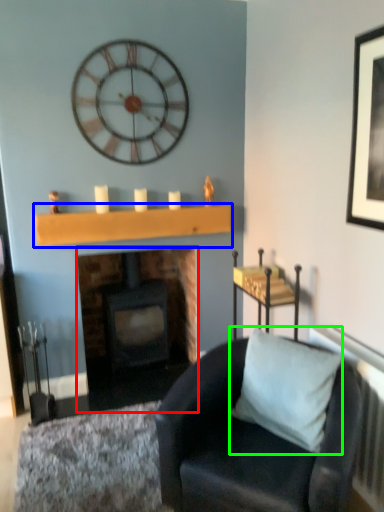
Question: Estimate the real-world distances between objects in this image. Which object is closer to fireplace (highlighted by a red box), shelf (highlighted by a blue box) or pillow (highlighted by a green box)?

Choices:
 (A) shelf
 (B) pillow

Answer: (A)